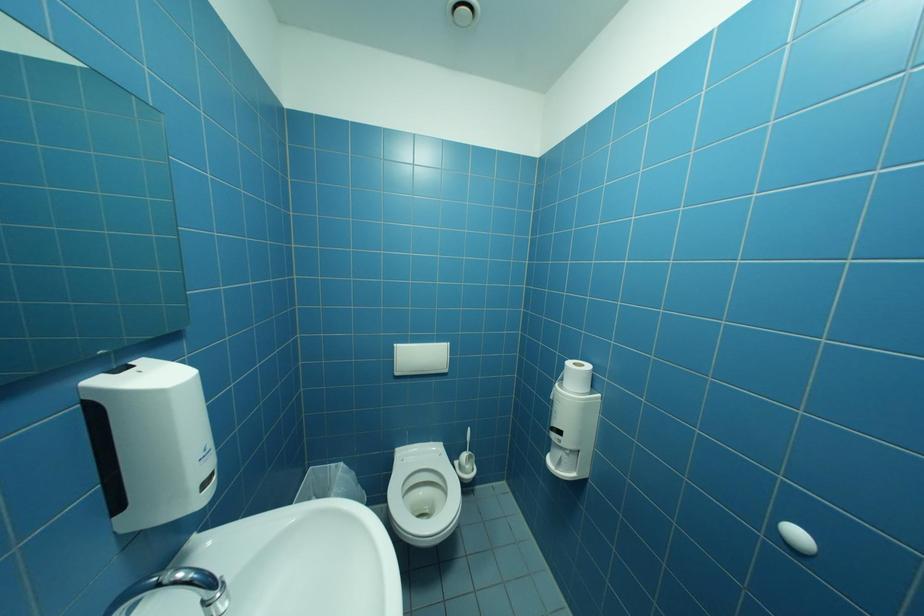
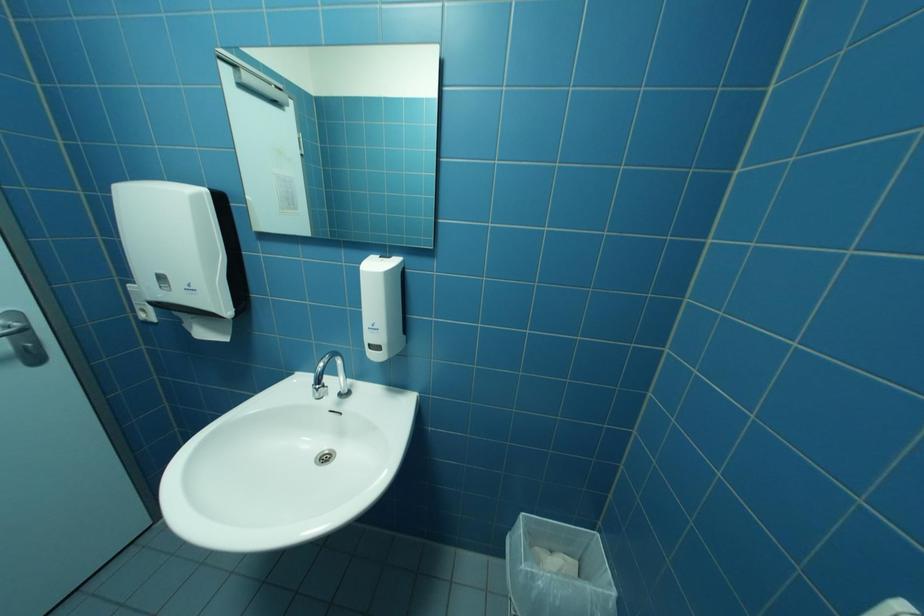
Based on the continuous images, in which direction is the camera rotating?

The camera rotated toward left-down.